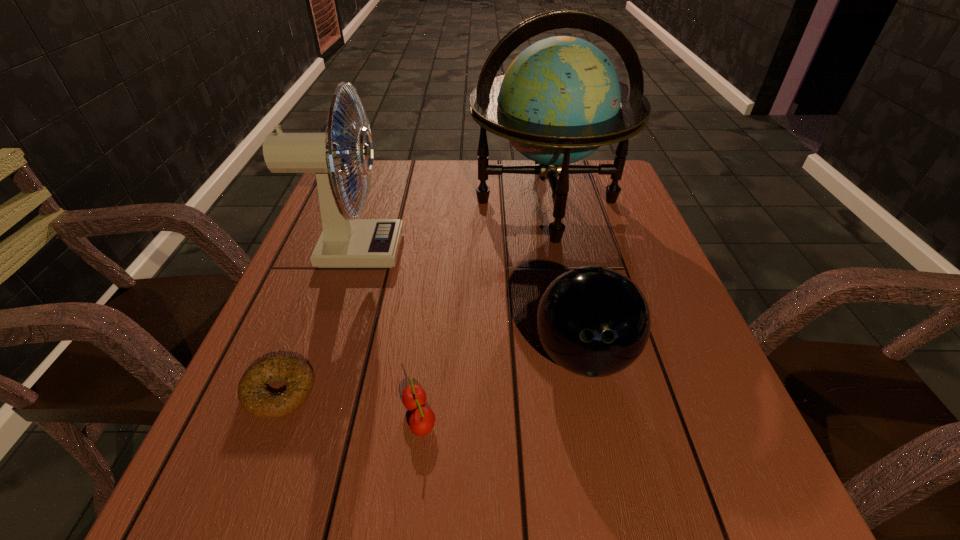
You are a GUI agent. You are given a task and a screenshot of the screen. Output one action in this format:
    pyautogui.click(x=<x>, y=<y>)
    Task: Click on the tallest object
    The width and height of the screenshot is (960, 540).
    Given the screenshot: What is the action you would take?
    pyautogui.click(x=560, y=99)

Find the location of a particular element. The width and height of the screenshot is (960, 540). the second tallest object is located at coordinates (344, 242).

Where is `bowling ball`? The height and width of the screenshot is (540, 960). bowling ball is located at coordinates (593, 321).

Locate an element on the screen. This screenshot has height=540, width=960. the second shortest object is located at coordinates (422, 420).

The width and height of the screenshot is (960, 540). I want to click on cherry, so click(x=422, y=420).

Find the location of a particular element. The height and width of the screenshot is (540, 960). the shortest object is located at coordinates (253, 393).

Locate an element on the screen. The height and width of the screenshot is (540, 960). free space located 0.320m on the surface of the tallest object is located at coordinates (580, 360).

You are a GUI agent. You are given a task and a screenshot of the screen. Output one action in this format:
    pyautogui.click(x=<x>, y=<y>)
    Task: Click on the free location located on the front-facing side of the fan
    Image resolution: width=960 pixels, height=540 pixels.
    Given the screenshot: What is the action you would take?
    pyautogui.click(x=466, y=251)

Image resolution: width=960 pixels, height=540 pixels. Find the location of `free spot located on the side of the bowling ball with the finger holes`. free spot located on the side of the bowling ball with the finger holes is located at coordinates (609, 474).

Identify the location of free space located on the right of the cherry. This screenshot has width=960, height=540. (475, 417).